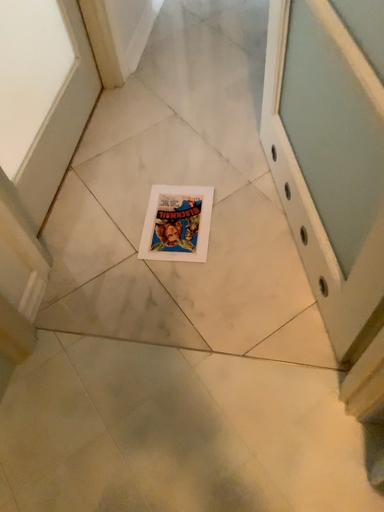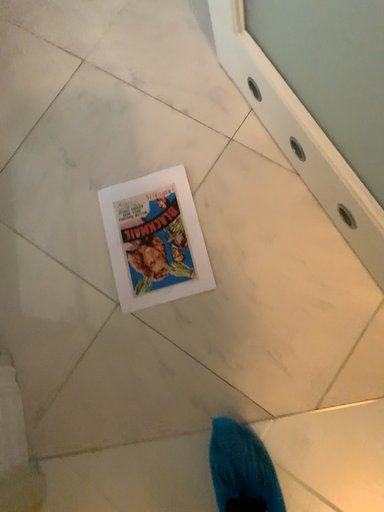
Question: How did the camera likely rotate when shooting the video?

Choices:
 (A) rotated upward
 (B) rotated downward

Answer: (B)